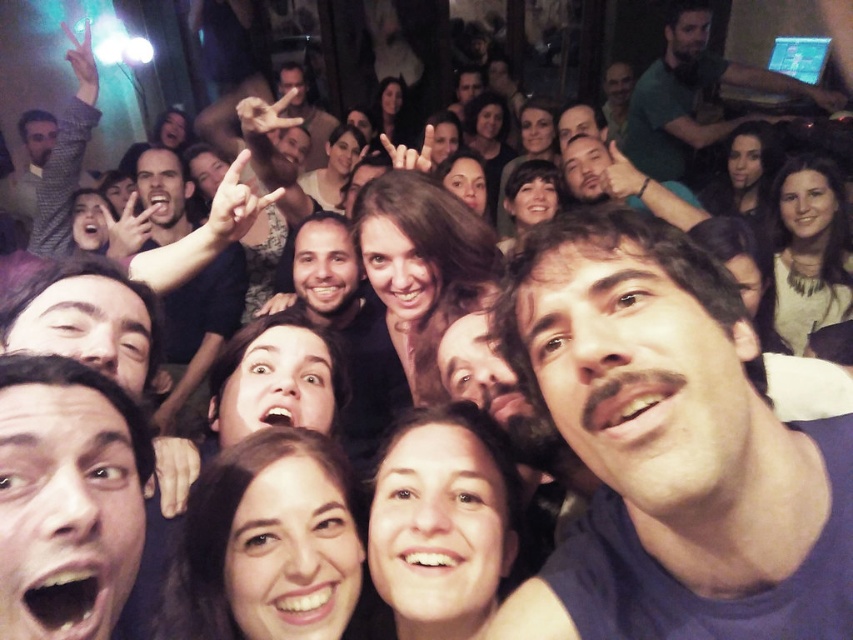
Question: Which object is positioned farthest from the smooth skin face at lower left?

Choices:
 (A) dark blue fabric at center
 (B) green matte shirt at upper right

Answer: (B)

Question: Can you confirm if smooth skin face at lower left is positioned to the left of green matte shirt at upper right?

Choices:
 (A) no
 (B) yes

Answer: (B)

Question: Which object is the closest to the smooth skin face at lower left?

Choices:
 (A) dark blue fabric at center
 (B) green matte shirt at upper right

Answer: (A)

Question: Can you confirm if dark blue fabric at center is positioned to the right of green matte shirt at upper right?

Choices:
 (A) yes
 (B) no

Answer: (B)

Question: Can you confirm if dark blue fabric at center is positioned below smooth skin face at lower left?

Choices:
 (A) yes
 (B) no

Answer: (B)

Question: Which of the following is the farthest from the observer?

Choices:
 (A) (683, 3)
 (B) (712, 426)

Answer: (A)